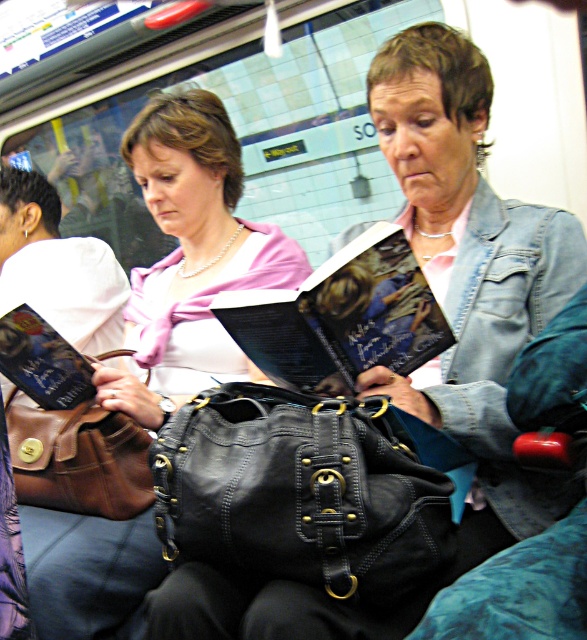
Is black leather bag at center shorter than brown leather handbag at lower left?

Correct, black leather bag at center is not as tall as brown leather handbag at lower left.

Measure the distance between black leather bag at center and camera.

They are 32.69 inches apart.

The width and height of the screenshot is (587, 640). In order to click on black leather bag at center in this screenshot , I will do `click(299, 492)`.

Which is above, black leather bag at center or matte black purse at center?

matte black purse at center is higher up.

Find the location of a particular element. The image size is (587, 640). black leather bag at center is located at coordinates click(x=299, y=492).

Image resolution: width=587 pixels, height=640 pixels. Identify the location of black leather bag at center. (299, 492).

Based on the photo, which of these two, hardcover book at center or brown leather handbag at lower left, stands shorter?

With less height is hardcover book at center.

Which is above, hardcover book at center or brown leather handbag at lower left?

hardcover book at center

The width and height of the screenshot is (587, 640). Find the location of `hardcover book at center`. hardcover book at center is located at coordinates click(x=342, y=317).